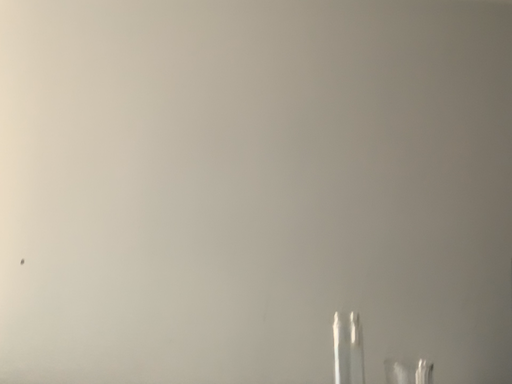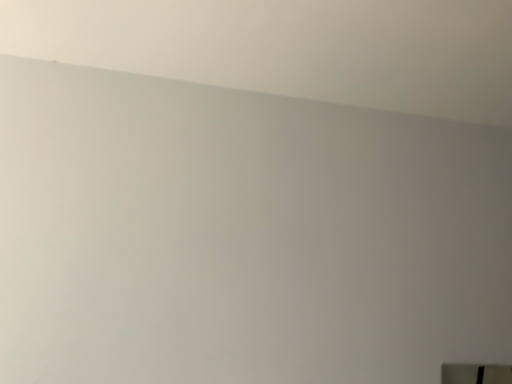
Question: Which way did the camera rotate in the video?

Choices:
 (A) rotated upward
 (B) rotated downward

Answer: (A)